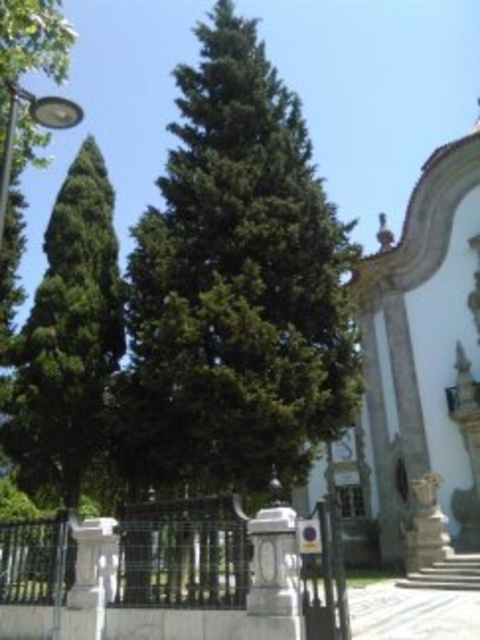
Question: Can you confirm if green leafy tree at center is positioned to the right of green leafy tree at left?

Choices:
 (A) yes
 (B) no

Answer: (A)

Question: Where is green leafy tree at center located in relation to green leafy tree at left in the image?

Choices:
 (A) above
 (B) below

Answer: (A)

Question: Which object appears farthest from the camera in this image?

Choices:
 (A) green leafy tree at center
 (B) green leafy tree at left

Answer: (B)

Question: Can you confirm if green leafy tree at center is positioned above green leafy tree at left?

Choices:
 (A) yes
 (B) no

Answer: (A)